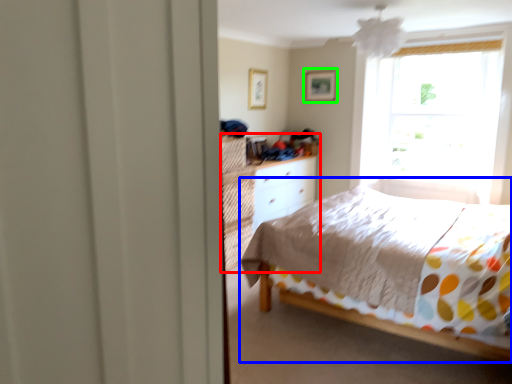
Question: Which object is the closest to the dresser (highlighted by a red box)? Choose among these: bed (highlighted by a blue box) or picture frame (highlighted by a green box).

Choices:
 (A) bed
 (B) picture frame

Answer: (A)